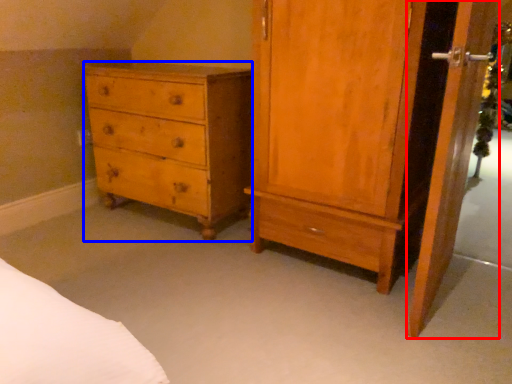
Question: Among these objects, which one is farthest to the camera, screen door (highlighted by a red box) or chest of drawers (highlighted by a blue box)?

Choices:
 (A) screen door
 (B) chest of drawers

Answer: (B)